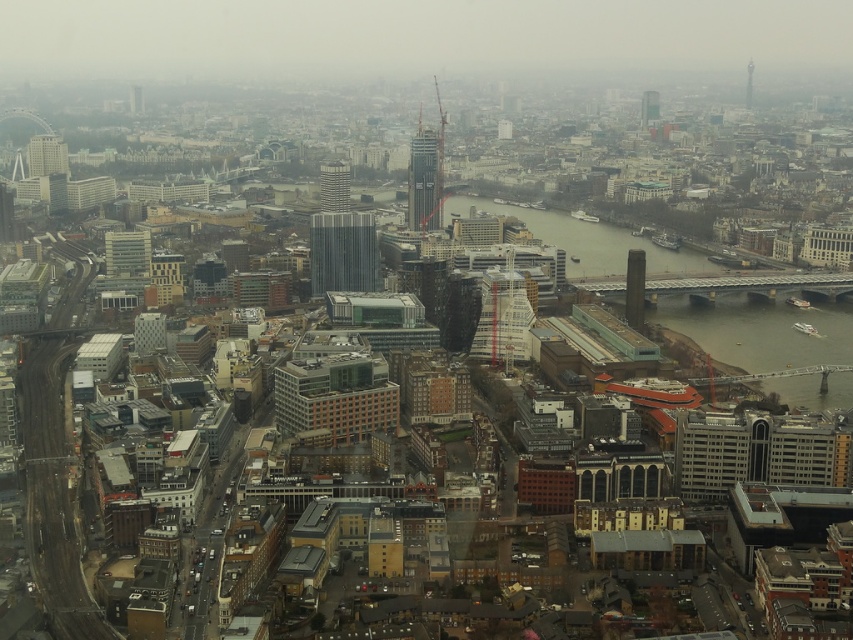
Question: Is green concrete river at center below shiny metallic tower at upper right?

Choices:
 (A) yes
 (B) no

Answer: (A)

Question: Which object appears closest to the camera in this image?

Choices:
 (A) glassy reflective skyscraper at center
 (B) metallic glass skyscraper at center

Answer: (B)

Question: Which point is closer to the camera taking this photo?

Choices:
 (A) (320, 224)
 (B) (463, 209)

Answer: (A)

Question: Can you confirm if metallic glass skyscraper at center is positioned to the right of shiny metallic tower at upper right?

Choices:
 (A) no
 (B) yes

Answer: (A)

Question: Based on their relative distances, which object is nearer to the shiny metallic tower at upper right?

Choices:
 (A) green concrete river at center
 (B) metallic glass skyscraper at center
 (C) glassy reflective skyscraper at center

Answer: (A)

Question: Does glassy steel tower at center appear on the right side of shiny metallic tower at upper right?

Choices:
 (A) yes
 (B) no

Answer: (B)